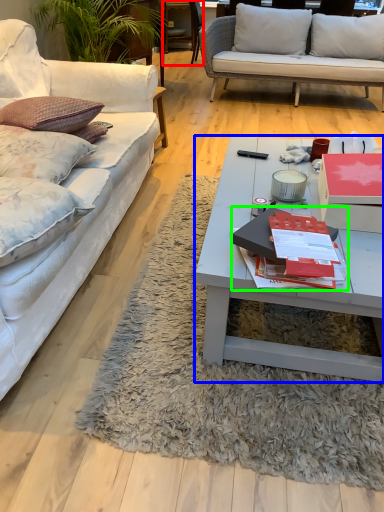
Question: Which is nearer to the chair (highlighted by a red box)? coffee table (highlighted by a blue box) or book (highlighted by a green box).

Choices:
 (A) coffee table
 (B) book

Answer: (A)